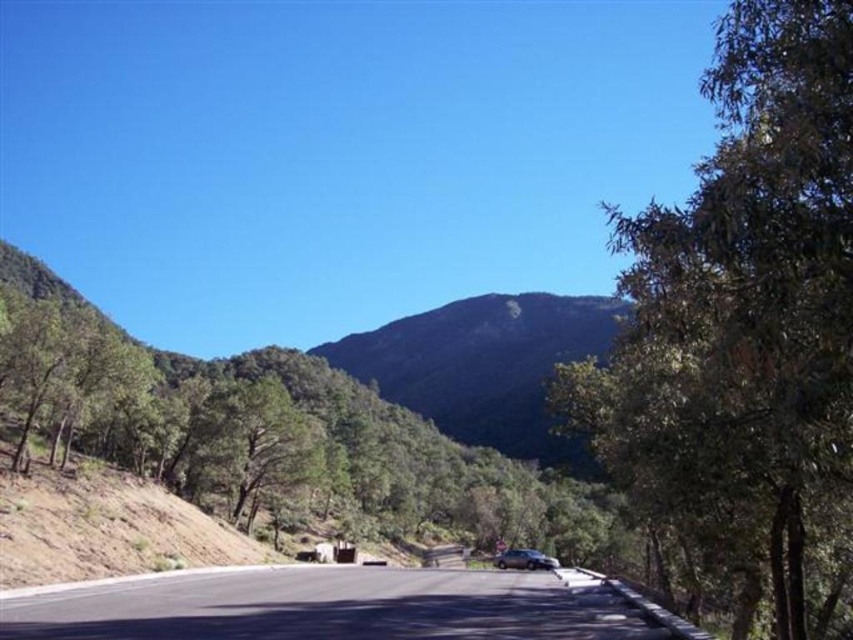
Is point (663, 436) positioned after point (454, 307)?

No, (663, 436) is closer to viewer.

Does point (717, 52) lie in front of point (518, 397)?

That is True.

Where is `green leafy tree at right`? This screenshot has width=853, height=640. green leafy tree at right is located at coordinates (744, 323).

Between green leafy tree at center and green forested mountain at center, which one has less height?

green forested mountain at center is shorter.

Is green leafy tree at center taller than green forested mountain at center?

Indeed, green leafy tree at center has a greater height compared to green forested mountain at center.

What do you see at coordinates (268, 435) in the screenshot?
I see `green leafy tree at center` at bounding box center [268, 435].

Find the location of a particular element. This screenshot has width=853, height=640. green leafy tree at center is located at coordinates (268, 435).

From the picture: Does green leafy tree at right have a greater width compared to green leafy tree at center?

No, green leafy tree at right is not wider than green leafy tree at center.

Is point (636, 429) in front of point (170, 429)?

Yes, it is.

Does point (699, 502) lie in front of point (482, 456)?

Yes, point (699, 502) is closer to viewer.

Identify the location of green leafy tree at right. (744, 323).